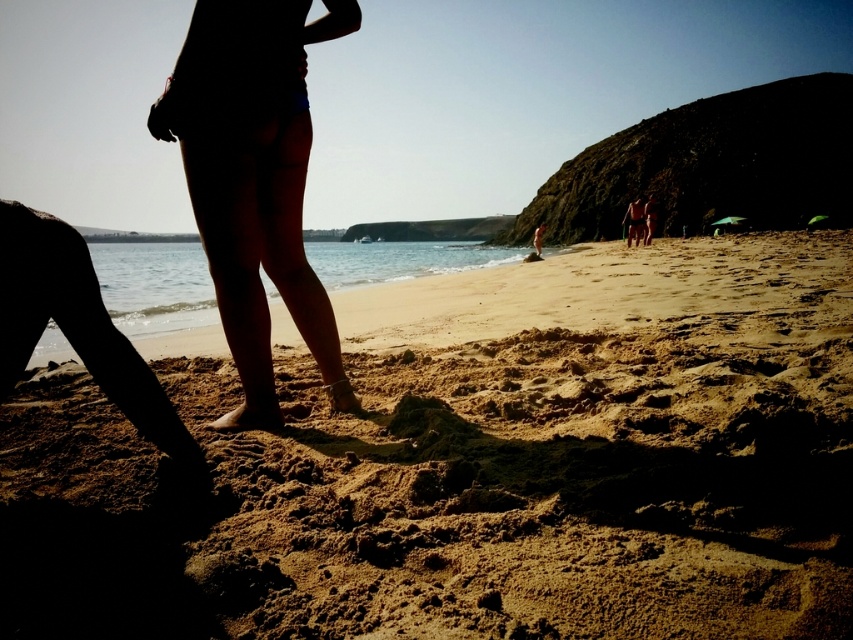
Question: Observing the image, what is the correct spatial positioning of fine-grained sand at lower center in reference to smooth skin bikini bottom at center?

Choices:
 (A) right
 (B) left

Answer: (A)

Question: Which object appears closest to the camera in this image?

Choices:
 (A) fine-grained sand at lower center
 (B) smooth skin bikini bottom at center

Answer: (A)

Question: Where is fine-grained sand at lower center located in relation to smooth skin bikini bottom at center in the image?

Choices:
 (A) above
 (B) below

Answer: (B)

Question: Which point is farther from the camera taking this photo?

Choices:
 (A) (833, 310)
 (B) (262, 35)

Answer: (A)

Question: Considering the relative positions of fine-grained sand at lower center and smooth skin bikini bottom at center in the image provided, where is fine-grained sand at lower center located with respect to smooth skin bikini bottom at center?

Choices:
 (A) above
 (B) below

Answer: (B)